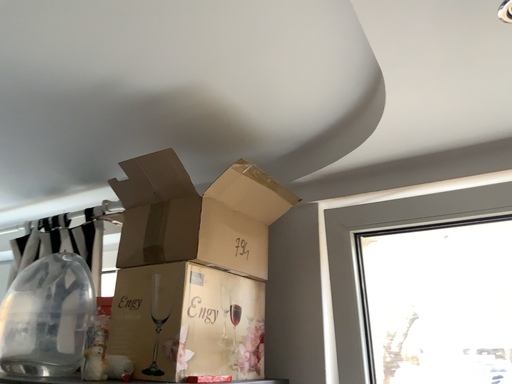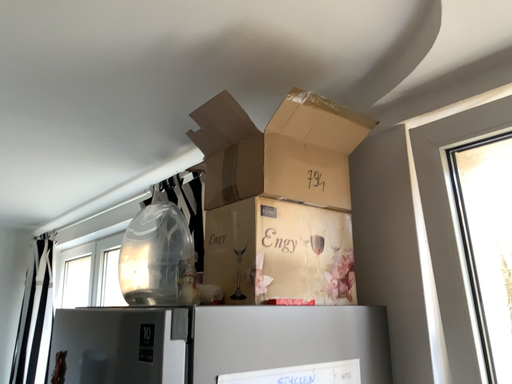
Question: How did the camera likely rotate when shooting the video?

Choices:
 (A) rotated left
 (B) rotated right

Answer: (A)